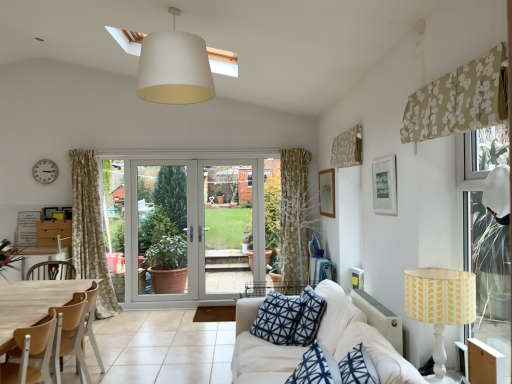
Question: Are white fabric couch at lower right and yellow fabric lampshade at right located far from each other?

Choices:
 (A) no
 (B) yes

Answer: (A)

Question: From a real-world perspective, is white fabric couch at lower right on yellow fabric lampshade at right?

Choices:
 (A) no
 (B) yes

Answer: (A)

Question: Is white fabric couch at lower right turned away from yellow fabric lampshade at right?

Choices:
 (A) no
 (B) yes

Answer: (B)

Question: Considering the relative positions of white fabric couch at lower right and yellow fabric lampshade at right in the image provided, is white fabric couch at lower right in front of yellow fabric lampshade at right?

Choices:
 (A) no
 (B) yes

Answer: (B)

Question: Is white fabric couch at lower right with yellow fabric lampshade at right?

Choices:
 (A) no
 (B) yes

Answer: (A)

Question: Is white fabric couch at lower right positioned beyond the bounds of yellow fabric lampshade at right?

Choices:
 (A) no
 (B) yes

Answer: (B)

Question: Is silver metallic clock at upper left in contact with white fabric couch at lower right?

Choices:
 (A) yes
 (B) no

Answer: (B)

Question: Does silver metallic clock at upper left have a greater height compared to white fabric couch at lower right?

Choices:
 (A) yes
 (B) no

Answer: (B)

Question: Is silver metallic clock at upper left far away from white fabric couch at lower right?

Choices:
 (A) no
 (B) yes

Answer: (B)

Question: Considering the relative sizes of silver metallic clock at upper left and white fabric couch at lower right in the image provided, is silver metallic clock at upper left wider than white fabric couch at lower right?

Choices:
 (A) yes
 (B) no

Answer: (B)

Question: Is silver metallic clock at upper left thinner than white fabric couch at lower right?

Choices:
 (A) no
 (B) yes

Answer: (B)

Question: Is silver metallic clock at upper left aimed at white fabric couch at lower right?

Choices:
 (A) no
 (B) yes

Answer: (A)

Question: From a real-world perspective, is yellow fabric lampshade at right beneath floral fabric curtain at upper right, marked as the first curtain in a back-to-front arrangement?

Choices:
 (A) yes
 (B) no

Answer: (A)